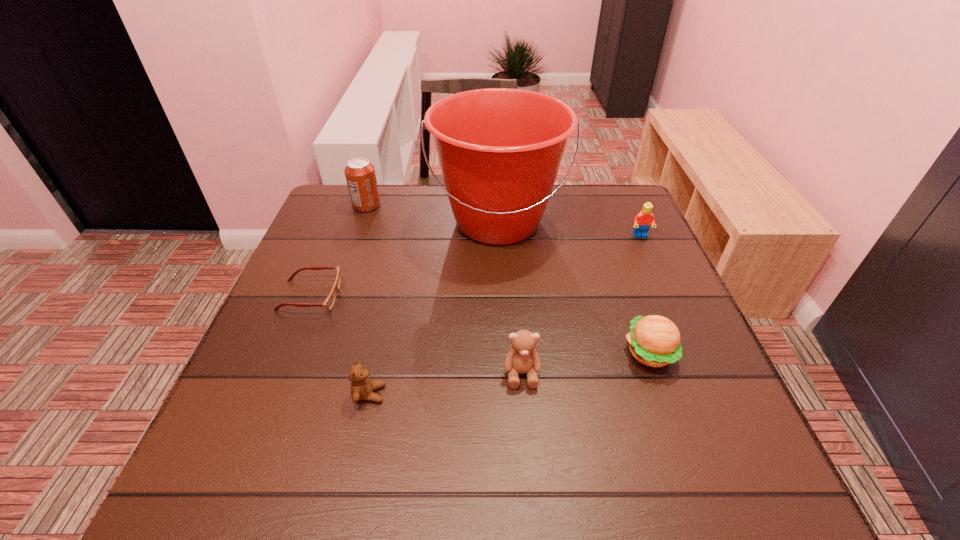
Image resolution: width=960 pixels, height=540 pixels. In order to click on unoccupied area between the third object from left to right and the shortest object in this screenshot , I will do `click(340, 345)`.

You are a GUI agent. You are given a task and a screenshot of the screen. Output one action in this format:
    pyautogui.click(x=<x>, y=<y>)
    Task: Click on the free space that is in between the shortest object and the rightmost object
    
    Given the screenshot: What is the action you would take?
    pyautogui.click(x=475, y=266)

This screenshot has width=960, height=540. What are the coordinates of `free spot between the right teddy bear and the left teddy bear` in the screenshot? It's located at (445, 384).

Find the location of `free space between the right teddy bear and the sixth object from left to right`. free space between the right teddy bear and the sixth object from left to right is located at coordinates (586, 363).

Find the location of a particular element. This screenshot has width=960, height=540. free space between the shortest object and the sixth shortest object is located at coordinates (338, 251).

Locate an element on the screen. The height and width of the screenshot is (540, 960). vacant space in between the tallest object and the sixth object from left to right is located at coordinates (574, 287).

The height and width of the screenshot is (540, 960). Identify the location of vacant region between the third object from left to right and the tallest object. (434, 308).

Find the location of a particular element. Image resolution: width=960 pixels, height=540 pixels. empty location between the shorter teddy bear and the Lego is located at coordinates (505, 315).

Locate an element on the screen. This screenshot has width=960, height=540. free point between the shorter teddy bear and the right teddy bear is located at coordinates (445, 384).

Select which object is the third closest to the Lego. Please provide its 2D coordinates. Your answer should be formatted as a tuple, i.e. [(x, y)], where the tuple contains the x and y coordinates of a point satisfying the conditions above.

[(522, 358)]